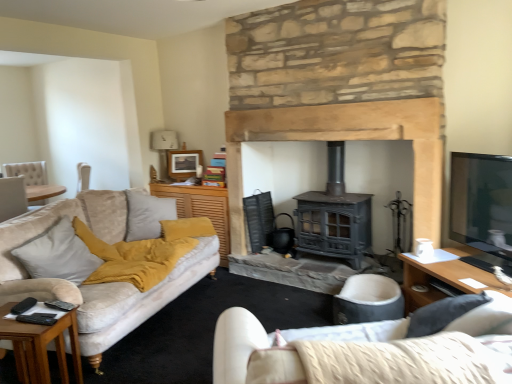
Question: Do you think soft gray fabric armchair at center is within wooden picture frame at upper center, or outside of it?

Choices:
 (A) inside
 (B) outside

Answer: (B)

Question: Does point (354, 289) appear closer or farther from the camera than point (188, 157)?

Choices:
 (A) closer
 (B) farther

Answer: (A)

Question: Which is farther from the soft gray fabric armchair at center?

Choices:
 (A) white fabric lampshade at upper center
 (B) matte black stove at center
 (C) soft beige cushion at left
 (D) yellow fabric cushion at center, the first table when ordered from back to front
 (E) wooden side table at lower left, which ranks as the 1th table in front-to-back order

Answer: (A)

Question: Considering the real-world distances, which object is closest to the white fabric studio couch at lower right?

Choices:
 (A) white fabric lampshade at upper center
 (B) yellow fabric cushion at center, acting as the 1th table starting from the right
 (C) wooden picture frame at upper center
 (D) matte black stove at center
 (E) wooden side table at lower left, the 1th table from the left

Answer: (E)